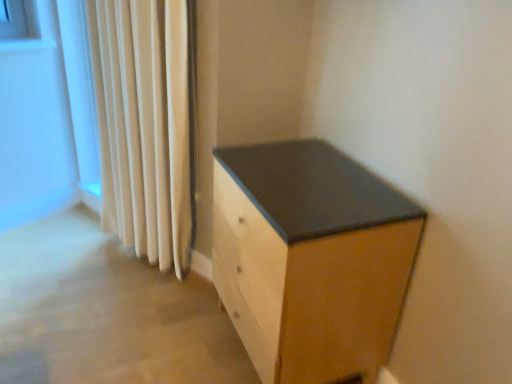
Find the location of `free region under beige fabric curtain at left (from a real-world perspective)`. free region under beige fabric curtain at left (from a real-world perspective) is located at coordinates (155, 273).